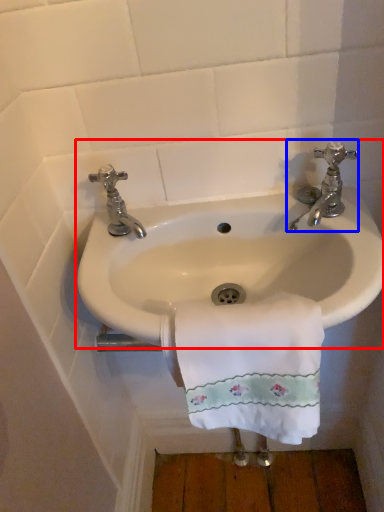
Question: Which of the following is the closest to the observer, sink (highlighted by a red box) or tap (highlighted by a blue box)?

Choices:
 (A) sink
 (B) tap

Answer: (A)